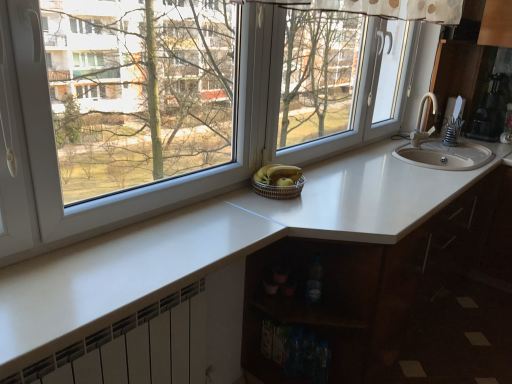
Question: Is woven brown basket at center shorter than metallic silver coffee maker at upper right?

Choices:
 (A) no
 (B) yes

Answer: (B)

Question: From the image's perspective, is woven brown basket at center over metallic silver coffee maker at upper right?

Choices:
 (A) no
 (B) yes

Answer: (A)

Question: Is woven brown basket at center next to metallic silver coffee maker at upper right and touching it?

Choices:
 (A) no
 (B) yes

Answer: (A)

Question: Does woven brown basket at center contain metallic silver coffee maker at upper right?

Choices:
 (A) yes
 (B) no

Answer: (B)

Question: Considering the relative sizes of woven brown basket at center and metallic silver coffee maker at upper right in the image provided, is woven brown basket at center taller than metallic silver coffee maker at upper right?

Choices:
 (A) no
 (B) yes

Answer: (A)

Question: From the image's perspective, does woven brown basket at center appear lower than metallic silver coffee maker at upper right?

Choices:
 (A) yes
 (B) no

Answer: (A)

Question: Are woven brown basket at center and white glossy countertop at center far apart?

Choices:
 (A) yes
 (B) no

Answer: (B)

Question: From the image's perspective, would you say woven brown basket at center is shown under white glossy countertop at center?

Choices:
 (A) no
 (B) yes

Answer: (A)

Question: Does woven brown basket at center have a smaller size compared to white glossy countertop at center?

Choices:
 (A) no
 (B) yes

Answer: (B)

Question: Is woven brown basket at center at the left side of white glossy countertop at center?

Choices:
 (A) no
 (B) yes

Answer: (B)

Question: Is woven brown basket at center not within white glossy countertop at center?

Choices:
 (A) yes
 (B) no

Answer: (A)

Question: Considering the relative sizes of woven brown basket at center and white glossy countertop at center in the image provided, is woven brown basket at center thinner than white glossy countertop at center?

Choices:
 (A) no
 (B) yes

Answer: (B)

Question: Could you tell me if transparent glass window at center is facing white glossy countertop at center?

Choices:
 (A) no
 (B) yes

Answer: (A)